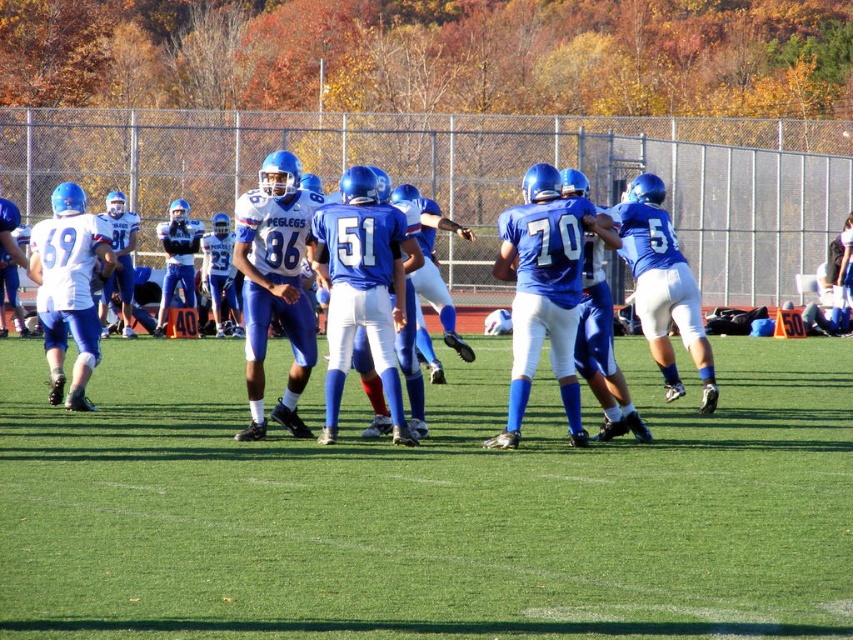
You are a football player standing at the edge of the field. You see the green artificial turf at center and the blue matte uniform at center. Which object is located to the left of the other?

The green artificial turf at center is positioned on the left side of blue matte uniform at center, so the green artificial turf at center is to the left of the blue matte uniform at center.

From the picture: You are a player in the blue matte uniform at center and you want to move to the sideline. Which direction should you move to avoid stepping on the green artificial turf at center?

The blue matte uniform at center is positioned over the green artificial turf at center, so to avoid stepping on it, you should move sideways away from the center towards the sideline.

In the scene shown: You are a player on the field and need to kick a ball to a teammate located at point (796, 611). If your maximum kicking distance is 6 meters, can you reach them?

The distance between you and point (796, 611) is 6.64 meters, which exceeds your maximum kicking distance of 6 meters. You cannot reach them.